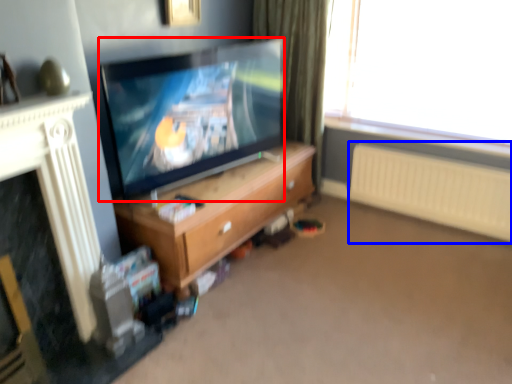
Question: Which object is closer to the camera taking this photo, television (highlighted by a red box) or radiator (highlighted by a blue box)?

Choices:
 (A) television
 (B) radiator

Answer: (A)